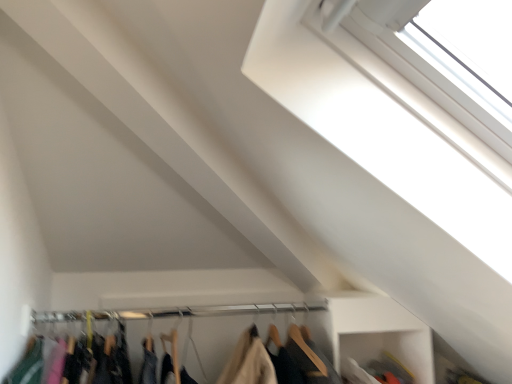
Question: Visually, is wooden hangers at lower center positioned to the left or to the right of white plastic window at upper right?

Choices:
 (A) left
 (B) right

Answer: (A)

Question: From a real-world perspective, is wooden hangers at lower center above or below white plastic window at upper right?

Choices:
 (A) below
 (B) above

Answer: (A)

Question: Estimate the real-world distances between objects in this image. Which object is farther from the white plastic window at upper right?

Choices:
 (A) wooden hangers at lower center
 (B) metallic silver clothesline at center

Answer: (A)

Question: Which of these objects is positioned closest to the white plastic window at upper right?

Choices:
 (A) metallic silver clothesline at center
 (B) wooden hangers at lower center

Answer: (A)